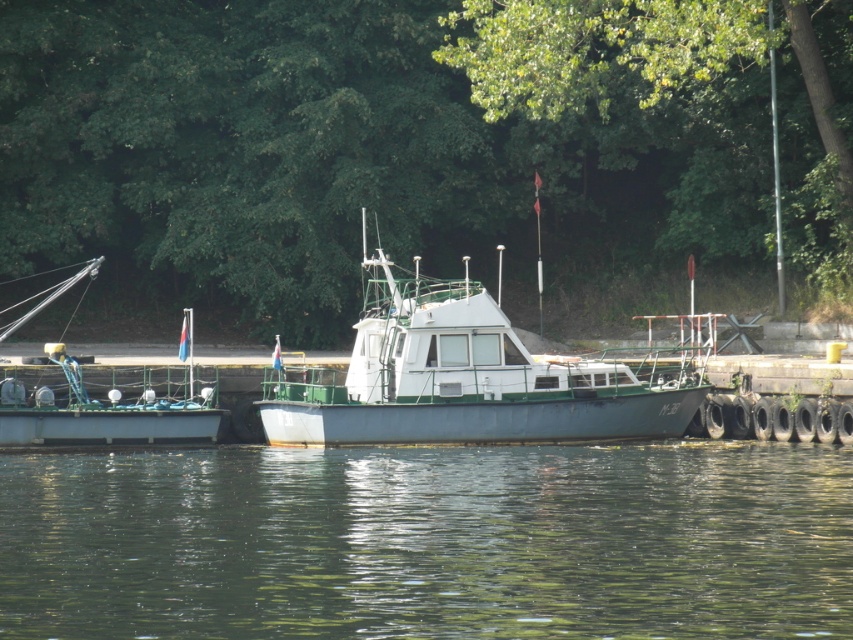
Question: Which of these objects is positioned closest to the white matte boat at center?

Choices:
 (A) green leafy tree at upper center
 (B) green matte boat at left

Answer: (B)

Question: Is greenish water at lower center smaller than white matte boat at center?

Choices:
 (A) no
 (B) yes

Answer: (A)

Question: Is green leafy tree at upper center wider than white matte boat at center?

Choices:
 (A) yes
 (B) no

Answer: (A)

Question: Considering the real-world distances, which object is farthest from the white matte boat at center?

Choices:
 (A) green leafy tree at upper center
 (B) greenish water at lower center

Answer: (A)

Question: Is green leafy tree at upper center bigger than green matte boat at left?

Choices:
 (A) no
 (B) yes

Answer: (B)

Question: Which point appears farthest from the camera in this image?

Choices:
 (A) (216, 538)
 (B) (106, 401)
 (C) (558, 406)

Answer: (B)